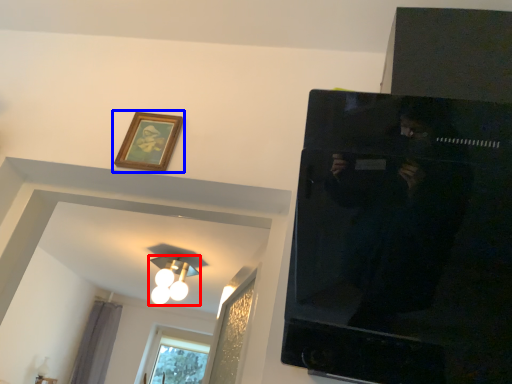
Question: Which object appears farthest to the camera in this image, light fixture (highlighted by a red box) or picture frame (highlighted by a blue box)?

Choices:
 (A) light fixture
 (B) picture frame

Answer: (A)